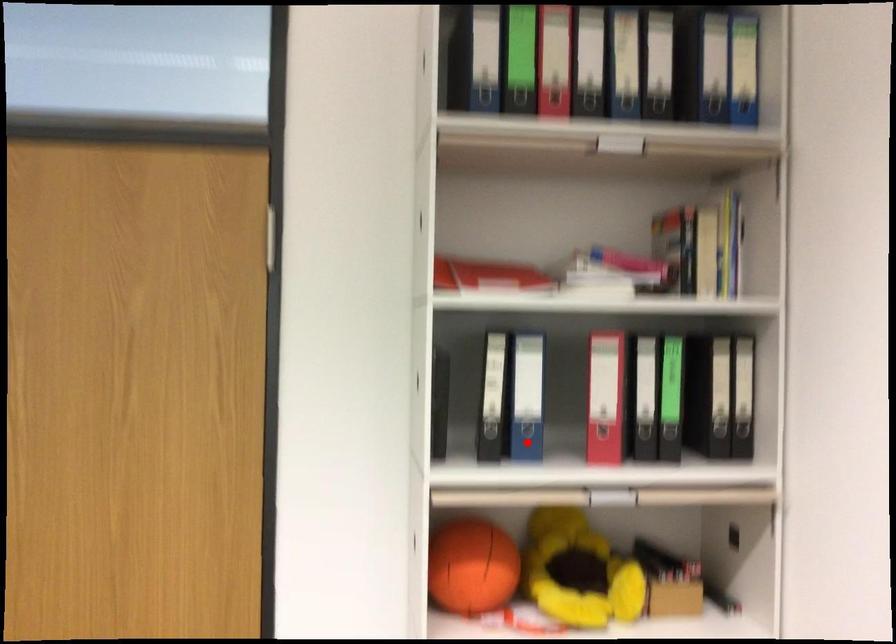
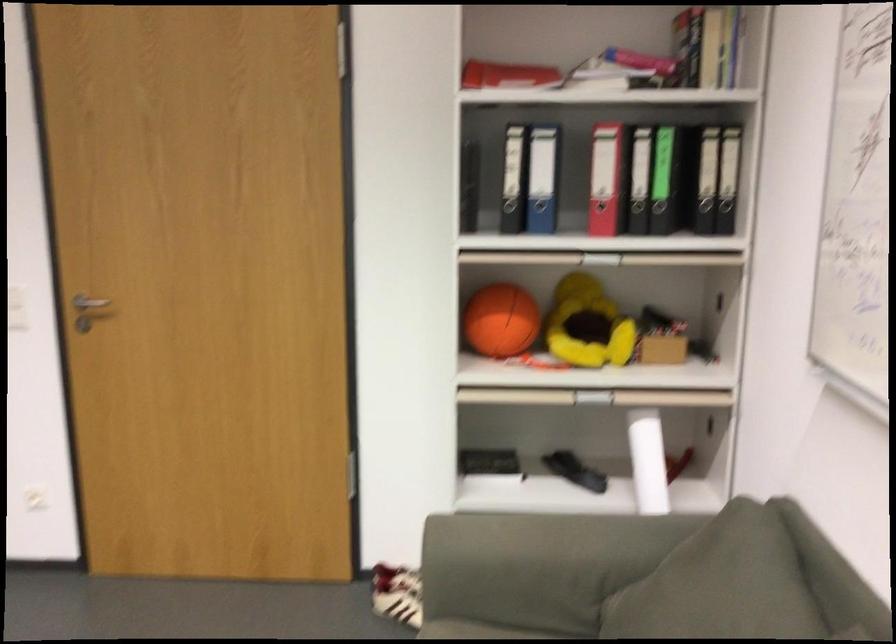
Where in the second image is the point corresponding to the highlighted location from the first image?

(539, 216)